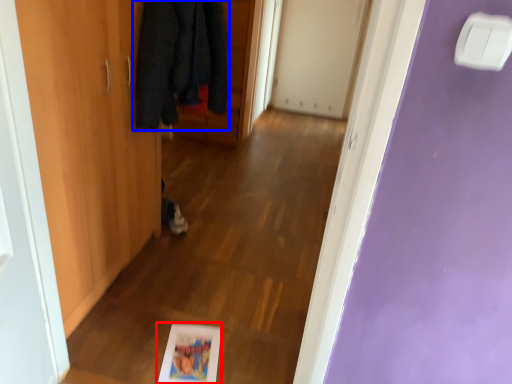
Question: Which object appears farthest to the camera in this image, picture frame (highlighted by a red box) or cloak (highlighted by a blue box)?

Choices:
 (A) picture frame
 (B) cloak

Answer: (A)